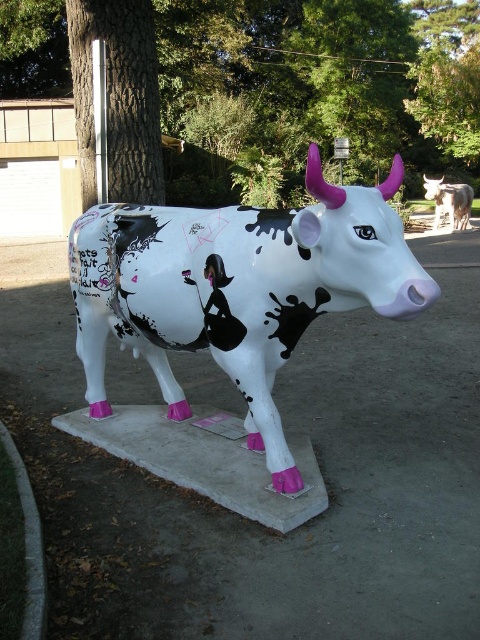
Describe the element at coordinates (238, 289) in the screenshot. I see `painted plastic cow at center` at that location.

Is painted plastic cow at center above white glossy cow at center?

Incorrect, painted plastic cow at center is not positioned above white glossy cow at center.

Where is `painted plastic cow at center`? painted plastic cow at center is located at coordinates (238, 289).

The width and height of the screenshot is (480, 640). In order to click on painted plastic cow at center in this screenshot , I will do `click(238, 289)`.